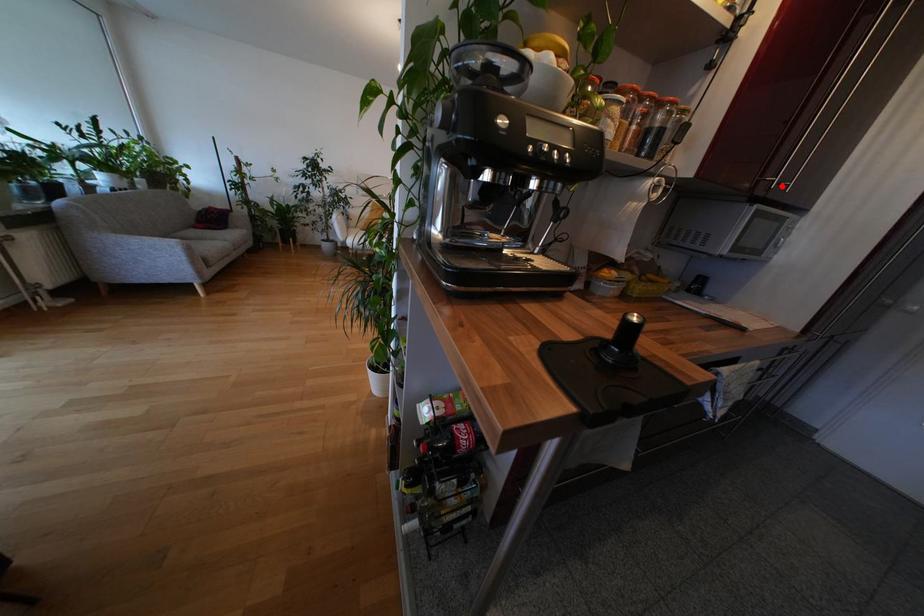
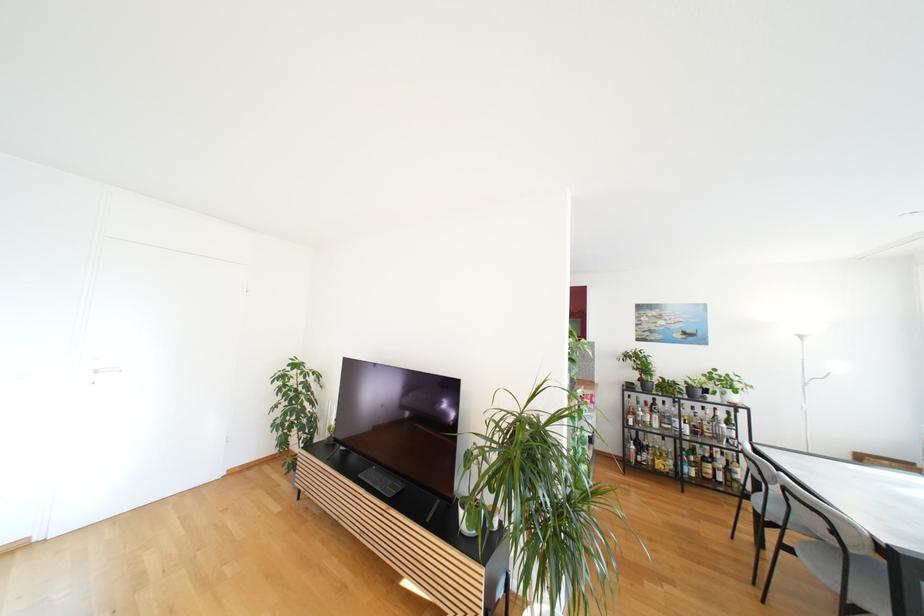
Question: I am providing you with two images of the same scene from different viewpoints. A red point is marked on the first image. At the location where the point appears in image 1, is it still visible in image 2?

Choices:
 (A) Yes
 (B) No

Answer: (B)